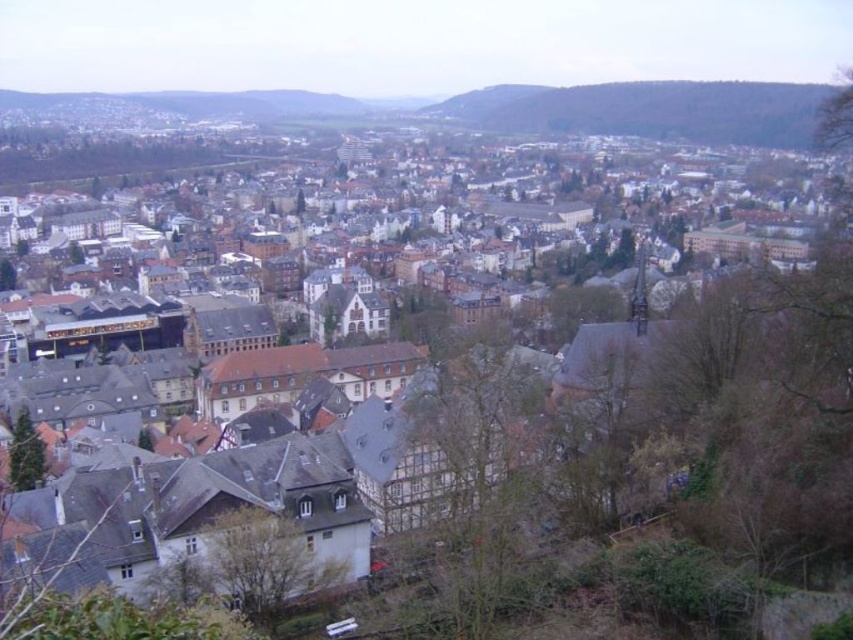
You are standing at the center of the European town and want to locate the green textured tree at center. According to the coordinates provided, in which direction should you look to find it?

The green textured tree at center is located at coordinates point (479, 477), which means you should look to the lower right direction to find it.

You are standing in the town square and looking towards the upper right corner of the image. Which object, the green grassy hillside at upper right or the green leafy tree at upper right, is positioned to the right of the other?

The green grassy hillside at upper right is to the right of the green leafy tree at upper right, so the hillside is positioned to the right of the tree.